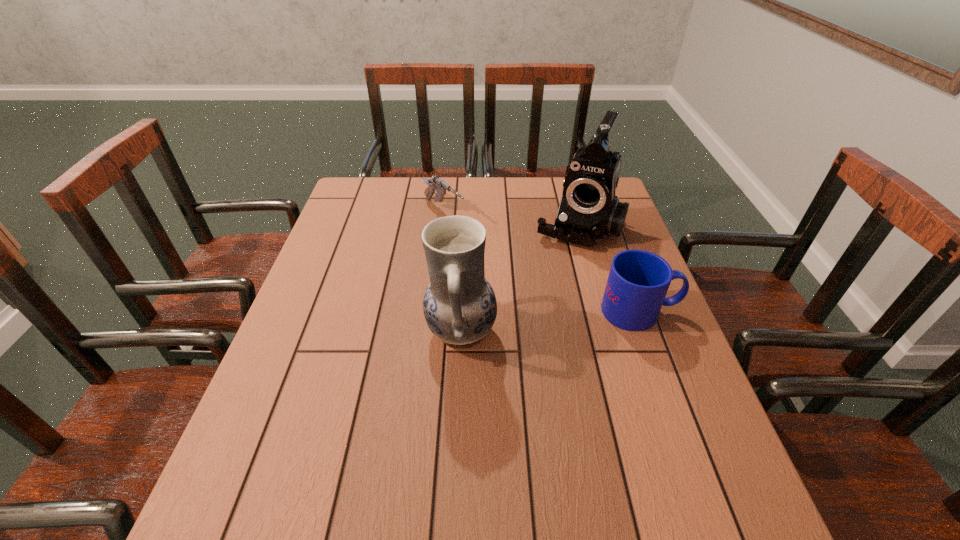
Locate an element on the screen. vacant space on the desktop that is between the pottery and the third tallest object and is positioned at the barrel of the shortest object is located at coordinates (572, 319).

Where is `vacant space on the desktop that is between the pottery and the mug and is positioned on the lens mount of the camcorder`? This screenshot has width=960, height=540. vacant space on the desktop that is between the pottery and the mug and is positioned on the lens mount of the camcorder is located at coordinates (534, 323).